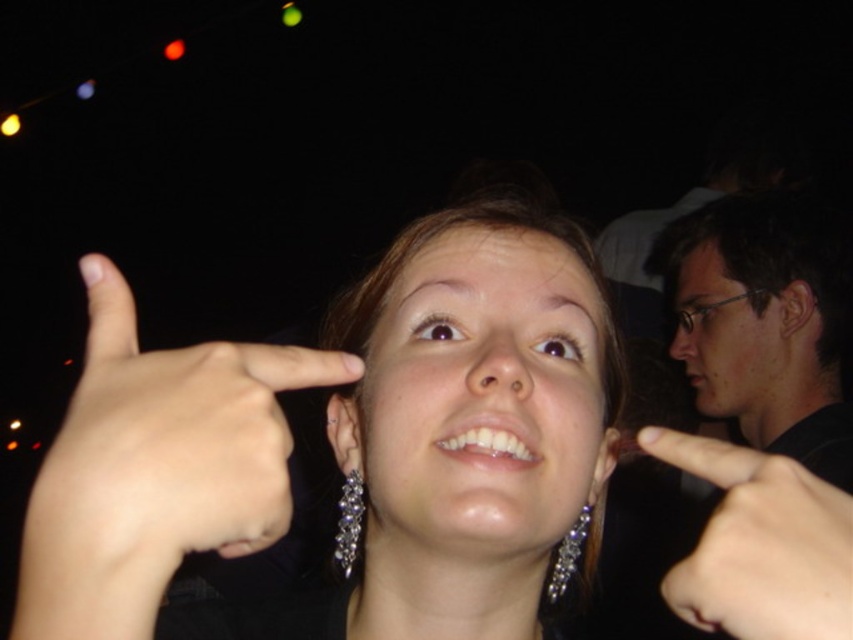
Looking at this image, who is more forward, (405,388) or (363,493)?

Positioned in front is point (405,388).

Is point (531, 289) closer to viewer compared to point (350, 541)?

That is True.

Is point (529, 449) less distant than point (361, 499)?

Yes.

Where is `silver metallic earrings at center`? Image resolution: width=853 pixels, height=640 pixels. silver metallic earrings at center is located at coordinates (349, 438).

Where is `silver metallic earrings at center`? silver metallic earrings at center is located at coordinates (349, 438).

Can you confirm if silver metallic earrings at center is thinner than skinny flesh-colored finger at upper right?

Incorrect, silver metallic earrings at center's width is not less than skinny flesh-colored finger at upper right's.

Which is in front, point (555, 262) or point (805, 624)?

Positioned in front is point (805, 624).

You are a GUI agent. You are given a task and a screenshot of the screen. Output one action in this format:
    pyautogui.click(x=<x>, y=<y>)
    Task: Click on the silver metallic earrings at center
    This screenshot has width=853, height=640.
    Given the screenshot: What is the action you would take?
    pyautogui.click(x=349, y=438)

Locate an element on the screen. Image resolution: width=853 pixels, height=640 pixels. silver metallic earrings at center is located at coordinates (349, 438).

Is silver metallic earrings at center positioned behind silver/glassy earrings at lower center?

No, it is in front of silver/glassy earrings at lower center.

Is point (500, 288) less distant than point (579, 516)?

Yes, point (500, 288) is in front of point (579, 516).

Image resolution: width=853 pixels, height=640 pixels. Find the location of `silver metallic earrings at center`. silver metallic earrings at center is located at coordinates (349, 438).